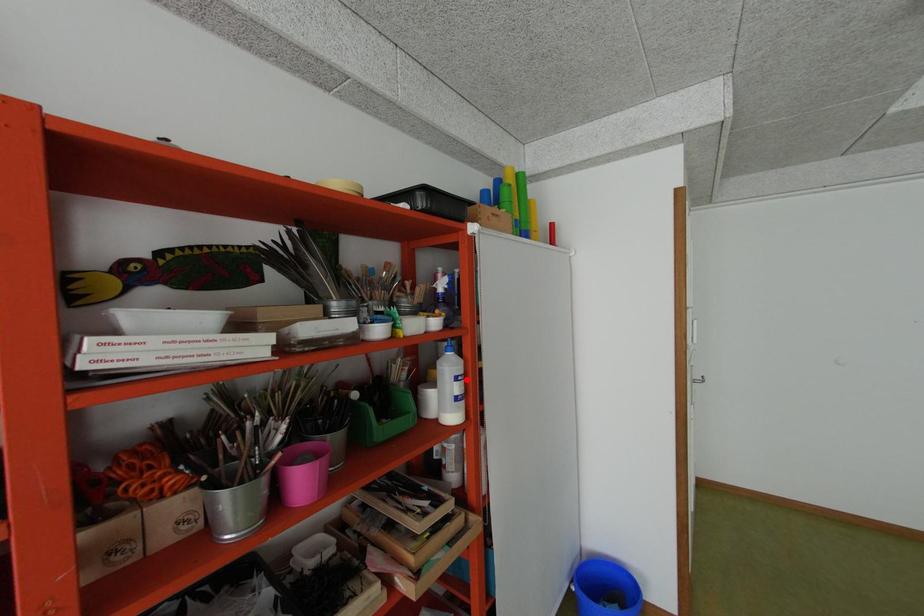
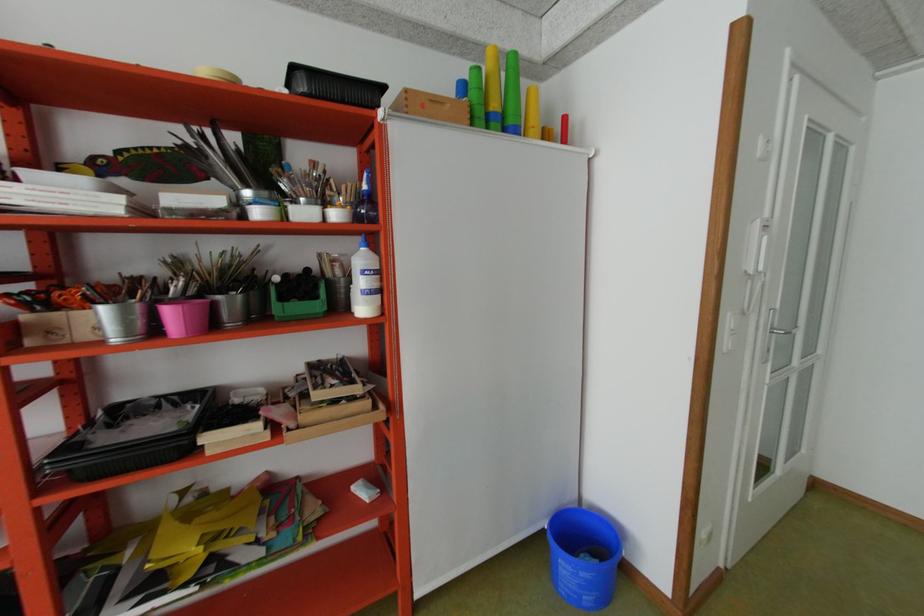
Question: I am providing you with two images of the same scene from different viewpoints. A red point is marked on the first image. At the location where the point appears in image 1, is it still visible in image 2?

Choices:
 (A) Yes
 (B) No

Answer: (A)